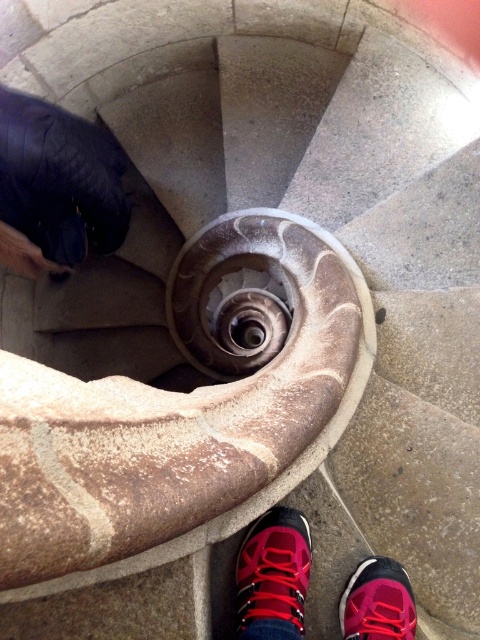
Which is more to the left, red suede shoe at lower center or pink fabric shoe at lower center?

red suede shoe at lower center is more to the left.

Locate an element on the screen. This screenshot has height=640, width=480. red suede shoe at lower center is located at coordinates (274, 576).

The height and width of the screenshot is (640, 480). I want to click on red suede shoe at lower center, so click(x=274, y=576).

Can you confirm if red fabric shoe at lower center is thinner than red suede shoe at lower center?

No.

Is red fabric shoe at lower center to the right of red suede shoe at lower center from the viewer's perspective?

Indeed, red fabric shoe at lower center is positioned on the right side of red suede shoe at lower center.

At what (x,y) coordinates should I click in order to perform the action: click on red fabric shoe at lower center. Please return your answer as a coordinate pair (x, y). The image size is (480, 640). Looking at the image, I should click on (274, 576).

The image size is (480, 640). Find the location of `red fabric shoe at lower center`. red fabric shoe at lower center is located at coordinates (274, 576).

Which is behind, point (249, 572) or point (404, 609)?

The point (249, 572) is behind.

I want to click on red fabric shoe at lower center, so click(x=274, y=576).